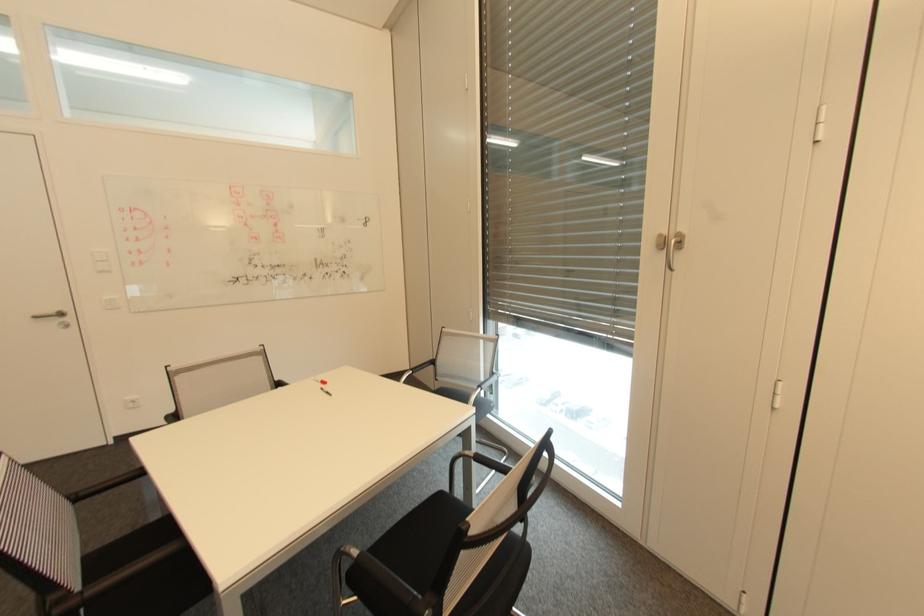
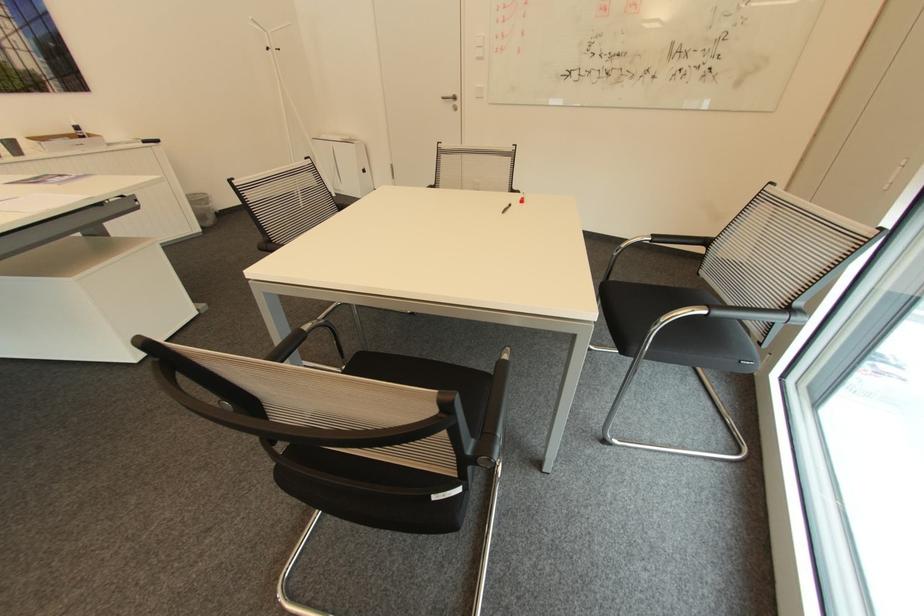
In the second image, find the point that corresponds to (106,270) in the first image.

(482, 59)